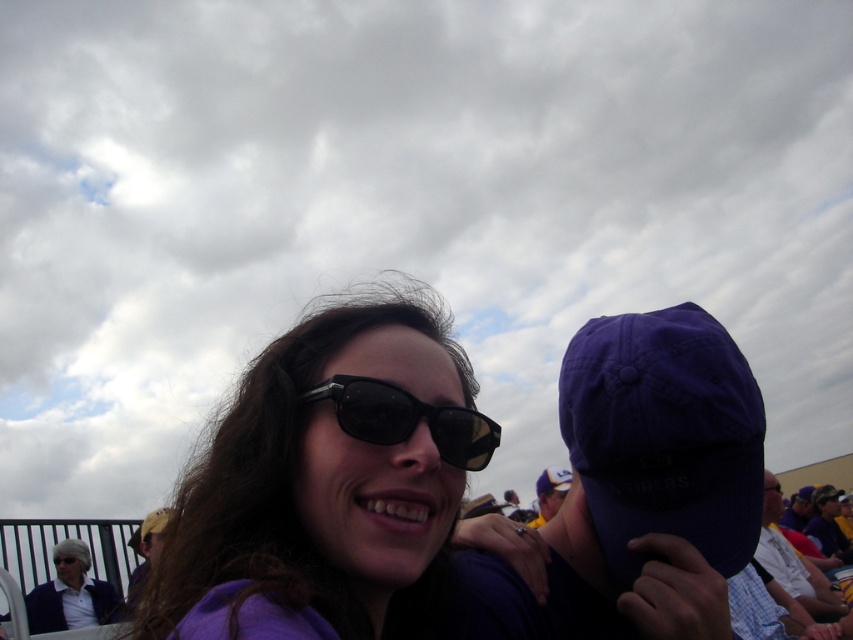
Question: Among these objects, which one is nearest to the camera?

Choices:
 (A) black plastic sunglasses at center
 (B) matte blue jacket at lower left
 (C) black reflective sunglasses at center
 (D) purple matte sunglasses at center

Answer: (D)

Question: Is purple matte sunglasses at center thinner than black reflective sunglasses at center?

Choices:
 (A) yes
 (B) no

Answer: (B)

Question: Which point is farther to the camera?

Choices:
 (A) (88, 548)
 (B) (68, 560)

Answer: (A)

Question: Does matte blue jacket at lower left have a smaller size compared to black plastic sunglasses at center?

Choices:
 (A) yes
 (B) no

Answer: (B)

Question: Can you confirm if purple matte sunglasses at center is positioned above black reflective sunglasses at center?

Choices:
 (A) yes
 (B) no

Answer: (B)

Question: Which object is positioned farthest from the matte blue jacket at lower left?

Choices:
 (A) black plastic sunglasses at center
 (B) black reflective sunglasses at center
 (C) purple fabric cap at center

Answer: (B)